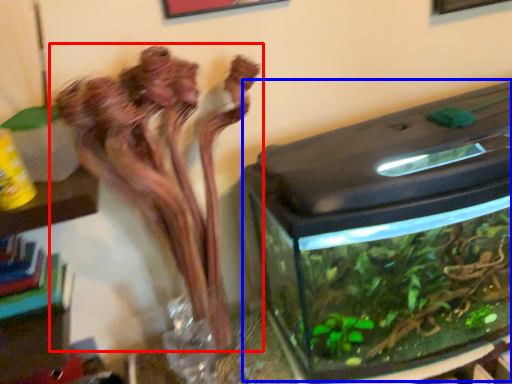
Question: Among these objects, which one is farthest to the camera, houseplant (highlighted by a red box) or water tank (highlighted by a blue box)?

Choices:
 (A) houseplant
 (B) water tank

Answer: (B)